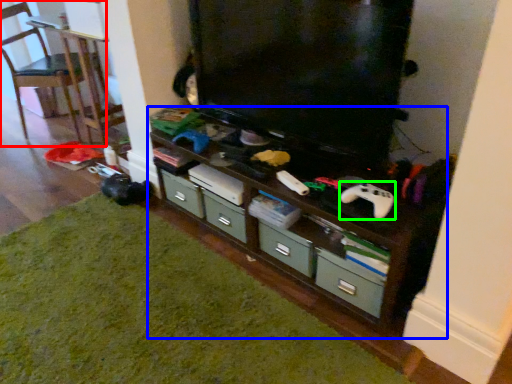
Question: Which is nearer to the chair (highlighted by a red box)? shelf (highlighted by a blue box) or game controller (highlighted by a green box).

Choices:
 (A) shelf
 (B) game controller

Answer: (A)